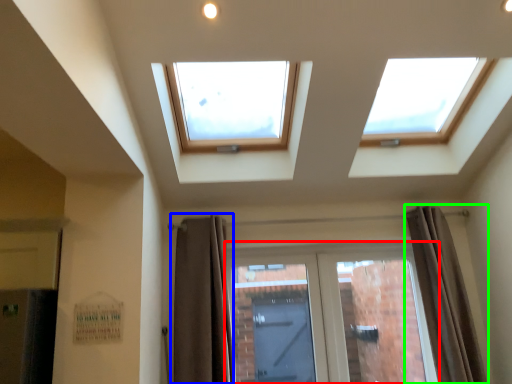
Question: Which is farther away from door (highlighted by a red box)? curtain (highlighted by a blue box) or curtain (highlighted by a green box)?

Choices:
 (A) curtain
 (B) curtain

Answer: (A)